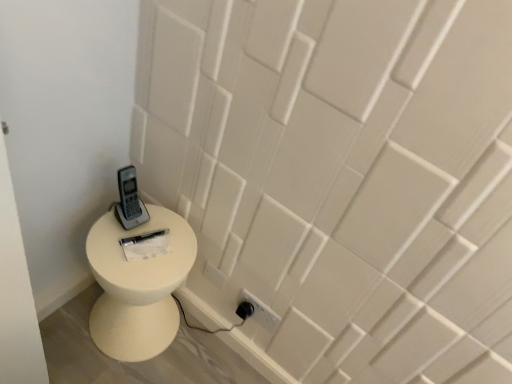
Question: In terms of width, does gray plastic phone at upper left look wider or thinner when compared to white matte toilet at lower left?

Choices:
 (A) thin
 (B) wide

Answer: (A)

Question: Which is correct: gray plastic phone at upper left is inside white matte toilet at lower left, or outside of it?

Choices:
 (A) outside
 (B) inside

Answer: (A)

Question: From a real-world perspective, relative to white matte toilet at lower left, is gray plastic phone at upper left vertically above or below?

Choices:
 (A) below
 (B) above

Answer: (B)

Question: From their relative heights in the image, would you say white matte toilet at lower left is taller or shorter than gray plastic phone at upper left?

Choices:
 (A) short
 (B) tall

Answer: (B)

Question: Is white matte toilet at lower left inside the boundaries of gray plastic phone at upper left, or outside?

Choices:
 (A) inside
 (B) outside

Answer: (B)

Question: Visually, is white matte toilet at lower left positioned to the left or to the right of gray plastic phone at upper left?

Choices:
 (A) right
 (B) left

Answer: (B)

Question: Is white matte toilet at lower left in front of or behind gray plastic phone at upper left in the image?

Choices:
 (A) front
 (B) behind

Answer: (A)